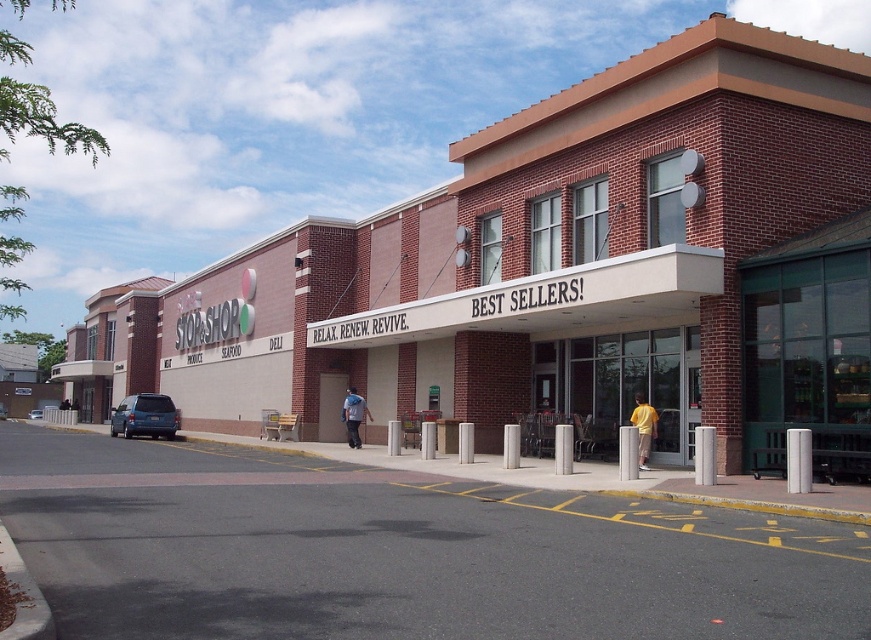
You are a customer standing at the entrance of the STOP AND SHOP store. You see a matte blue suv at left and a yellow cotton shirt at center. Which object is closer to the entrance?

The yellow cotton shirt at center is closer to the entrance because the matte blue suv at left is positioned on the left side of it, meaning the shirt is between the entrance and the SUV.

You are a customer arriving at the STOP AND SHOP store and see a matte blue suv at left and a yellow cotton shirt at center. Which object is located closer to the entrance of the store?

The yellow cotton shirt at center is closer to the entrance of the store because the matte blue suv at left is positioned under it, meaning the shirt is above and thus nearer to the entrance.

You are trying to decide which clothing item to take with you. The yellow cotton shirt at center and the blue denim jacket at center are both on display. Which item takes up less space when folded?

The yellow cotton shirt at center is thinner than the blue denim jacket at center, so it takes up less space when folded.